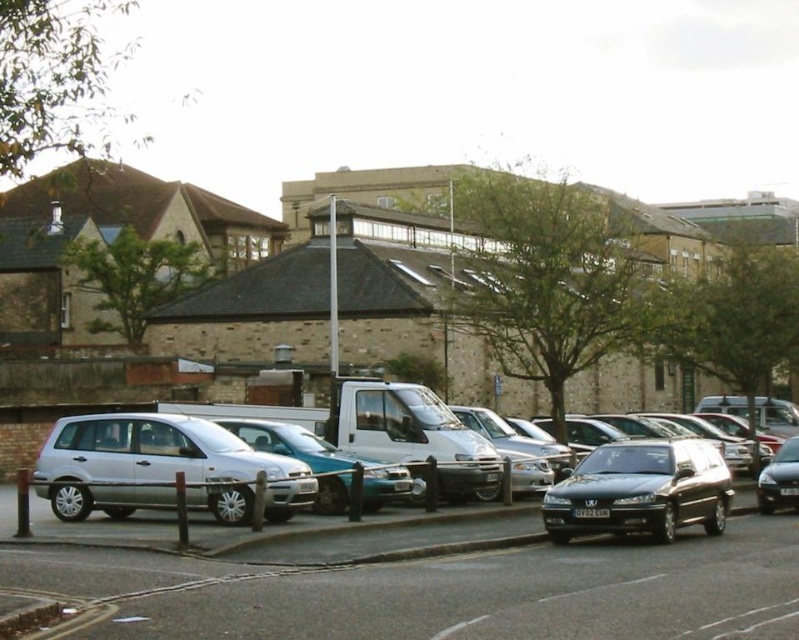
Question: Among these objects, which one is nearest to the camera?

Choices:
 (A) silver metallic car at center
 (B) silver metallic van at center
 (C) shiny black car at center

Answer: (A)

Question: Can you confirm if silver metallic car at center is smaller than shiny black sedan at right?

Choices:
 (A) yes
 (B) no

Answer: (B)

Question: Is silver metallic minivan at center thinner than shiny black sedan at right?

Choices:
 (A) no
 (B) yes

Answer: (A)

Question: Which object is positioned closest to the silver metallic car at center?

Choices:
 (A) white plastic license plate at center
 (B) silver metallic van at center
 (C) shiny black sedan at right

Answer: (B)

Question: Does silver metallic minivan at center appear on the left side of white plastic license plate at center?

Choices:
 (A) yes
 (B) no

Answer: (A)

Question: Which object is the closest to the white plastic license plate at center?

Choices:
 (A) silver metallic minivan at center
 (B) shiny black sedan at right
 (C) silver metallic car at center

Answer: (B)